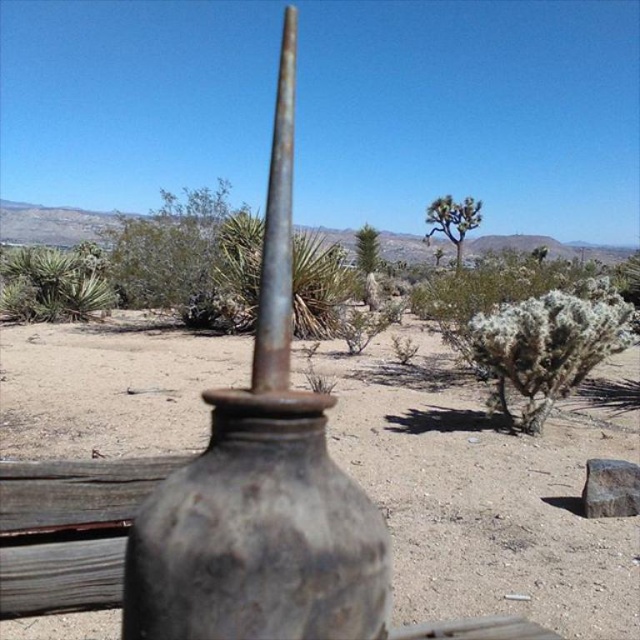
Question: Is rusty metallic dirt field at center wider than green shrub at center?

Choices:
 (A) yes
 (B) no

Answer: (B)

Question: Is green shrub at center smaller than green leafy plant at upper left?

Choices:
 (A) no
 (B) yes

Answer: (A)

Question: Estimate the real-world distances between objects in this image. Which object is farther from the rusty metal vase at center?

Choices:
 (A) green leafy tree at center
 (B) rusty metallic dirt field at center
 (C) green leafy plant at upper left
 (D) green shrub at center

Answer: (A)

Question: Is green shrub at center further to the viewer compared to green leafy plant at upper left?

Choices:
 (A) yes
 (B) no

Answer: (B)

Question: Estimate the real-world distances between objects in this image. Which object is closer to the green leafy plant at upper left?

Choices:
 (A) rusty metal vase at center
 (B) green leafy tree at center

Answer: (A)

Question: Which point is farther to the camera?

Choices:
 (A) (236, 397)
 (B) (96, 376)

Answer: (B)